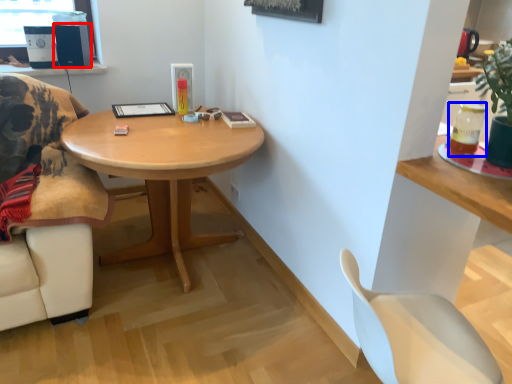
Question: Among these objects, which one is nearest to the camera, speaker (highlighted by a red box) or beverage (highlighted by a blue box)?

Choices:
 (A) speaker
 (B) beverage

Answer: (B)